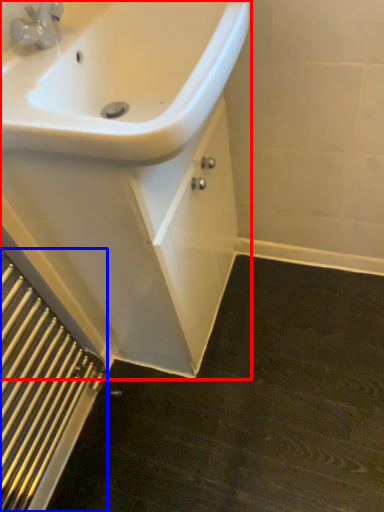
Question: Which point is closer to the camera, porcelain (highlighted by a red box) or radiator (highlighted by a blue box)?

Choices:
 (A) porcelain
 (B) radiator

Answer: (B)